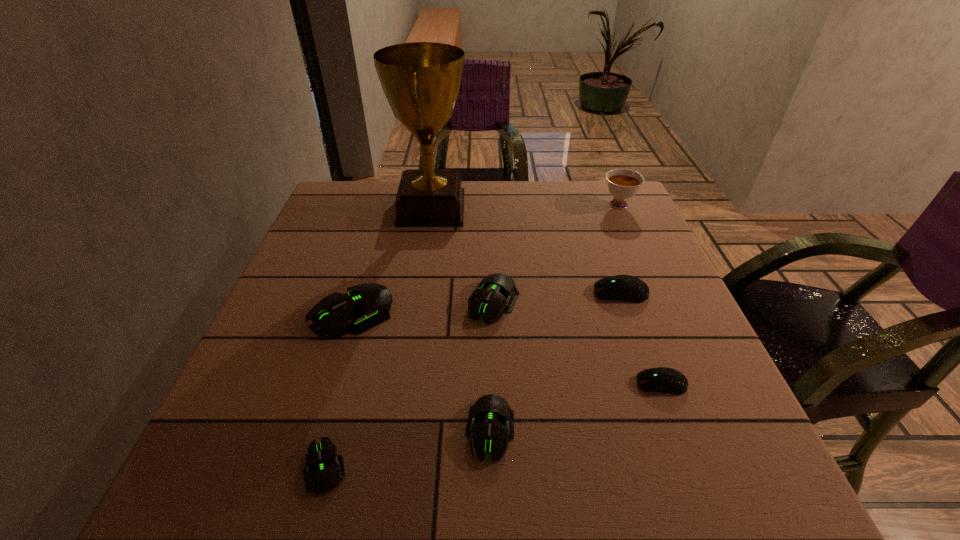
Point out which gray computer mouse is positioned as the second nearest to the bigger dark computer equipment. Please provide its 2D coordinates. Your answer should be formatted as a tuple, i.e. [(x, y)], where the tuple contains the x and y coordinates of a point satisfying the conditions above.

[(490, 425)]

The height and width of the screenshot is (540, 960). In order to click on vacant point that satisfies the following two spatial constraints: 1. on the plaque of the award; 2. on the back side of the second biggest gray computer mouse in this screenshot , I will do `click(418, 303)`.

In order to click on blank area in the image that satisfies the following two spatial constraints: 1. on the plaque of the second biggest gray computer mouse; 2. on the right side of the tallest object in this screenshot , I will do (418, 303).